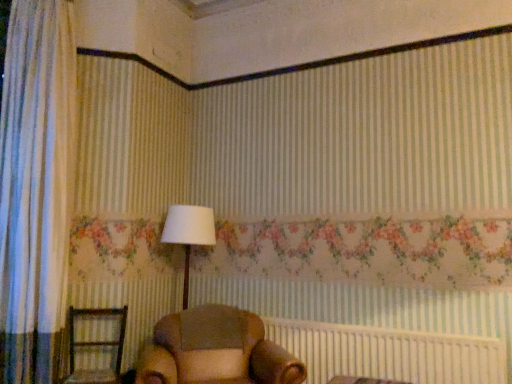
Question: Is brown fabric bed frame at lower center taller or shorter than brown leather armchair at center, which is counted as the 1th furniture, starting from the right?

Choices:
 (A) tall
 (B) short

Answer: (B)

Question: From the image's perspective, is brown fabric bed frame at lower center located above or below brown leather armchair at center, which ranks as the second furniture in left-to-right order?

Choices:
 (A) above
 (B) below

Answer: (B)

Question: Which object is the farthest from the brown fabric bed frame at lower center?

Choices:
 (A) brown wooden chair at lower left, which ranks as the 2th furniture in right-to-left order
 (B) white fabric lampshade at center
 (C) brown leather armchair at center, which ranks as the second furniture in left-to-right order

Answer: (A)

Question: Estimate the real-world distances between objects in this image. Which object is closer to the brown leather armchair at center, which is counted as the 1th furniture, starting from the right?

Choices:
 (A) brown wooden chair at lower left, the 1th furniture positioned from the left
 (B) white fabric lampshade at center
 (C) brown fabric bed frame at lower center

Answer: (C)